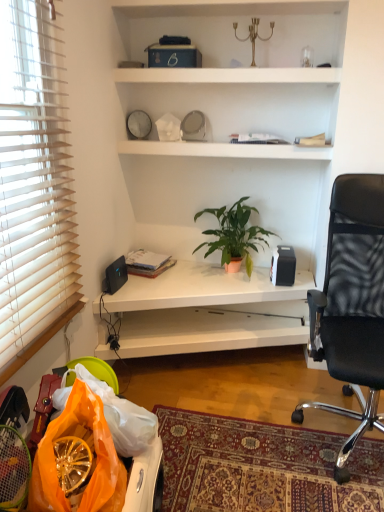
Identify the location of vacant space situated on the left part of black matte speaker at upper right, which ranks as the second loudspeaker in left-to-right order. Image resolution: width=384 pixels, height=512 pixels. (244, 275).